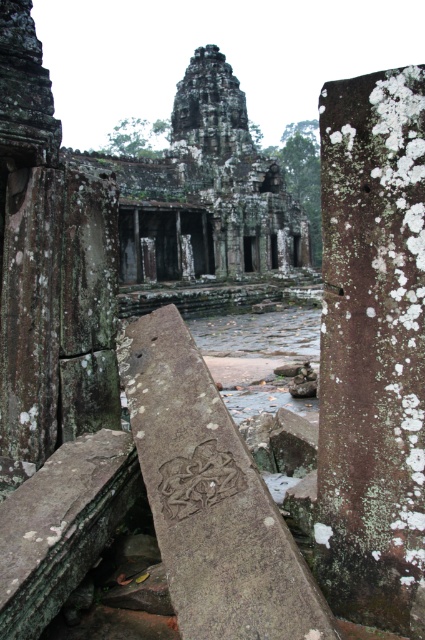
Is lichen-covered stone at center positioned before brown stone carving at center?

No.

Can you confirm if lichen-covered stone at center is shorter than brown stone carving at center?

Incorrect, lichen-covered stone at center's height does not fall short of brown stone carving at center's.

At what (x,y) coordinates should I click in order to perform the action: click on lichen-covered stone at center. Please return your answer as a coordinate pair (x, y). Looking at the image, I should click on (371, 348).

At what (x,y) coordinates should I click in order to perform the action: click on lichen-covered stone at center. Please return your answer as a coordinate pair (x, y). This screenshot has height=640, width=425. Looking at the image, I should click on (371, 348).